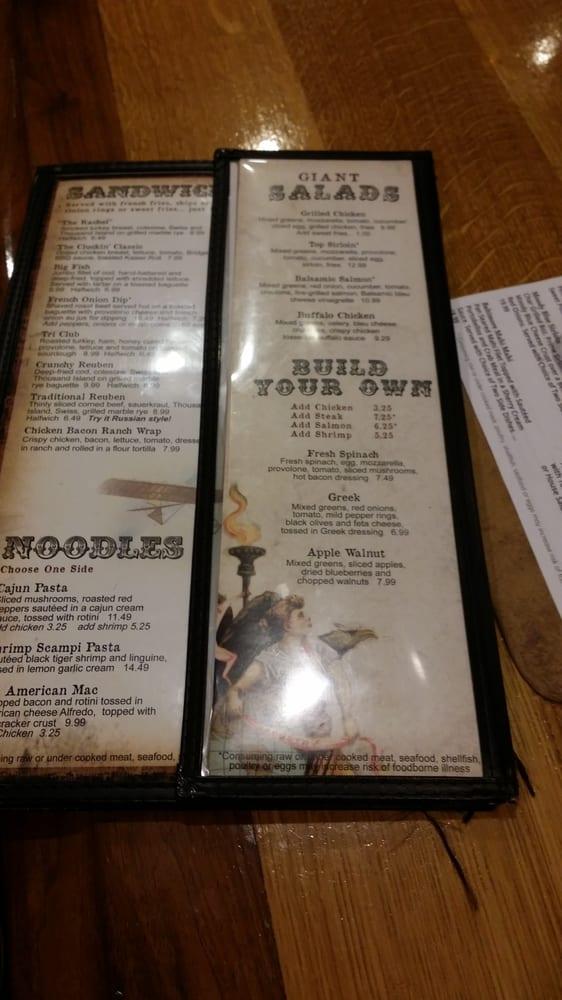
At what (x,y) coordinates should I click in order to perform the action: click on stains. Please return your answer as a coordinate pair (x, y). Image resolution: width=562 pixels, height=1000 pixels. Looking at the image, I should click on (48, 748), (26, 761).